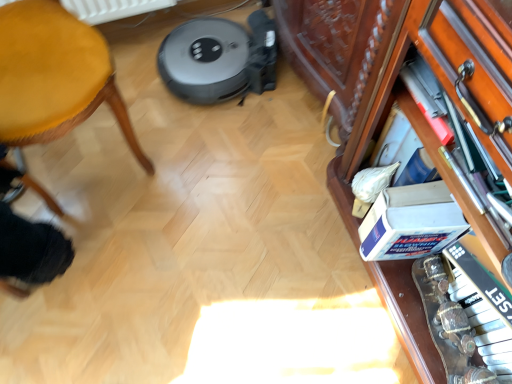
Question: Do you think wooden drawer at right is within white cardboard box at lower right, or outside of it?

Choices:
 (A) inside
 (B) outside

Answer: (B)

Question: From a real-world perspective, is wooden drawer at right above or below white cardboard box at lower right?

Choices:
 (A) above
 (B) below

Answer: (A)

Question: Which is nearer to the white cardboard box at lower right?

Choices:
 (A) wooden piano keys at right
 (B) wooden drawer at right
 (C) yellow fabric stool at left

Answer: (A)

Question: Which object is positioned closest to the white cardboard box at lower right?

Choices:
 (A) wooden piano keys at right
 (B) wooden drawer at right
 (C) yellow fabric stool at left

Answer: (A)